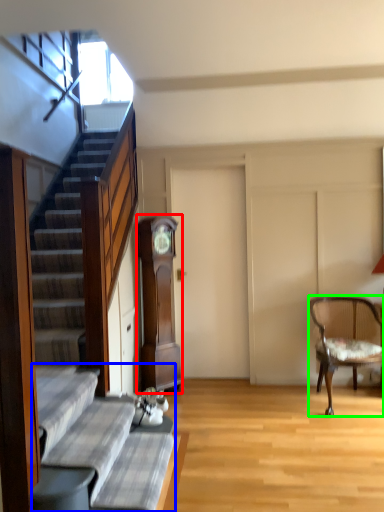
Question: Which object is the farthest from cabinetry (highlighted by a red box)? Choose among these: couch (highlighted by a blue box) or chair (highlighted by a green box).

Choices:
 (A) couch
 (B) chair

Answer: (A)